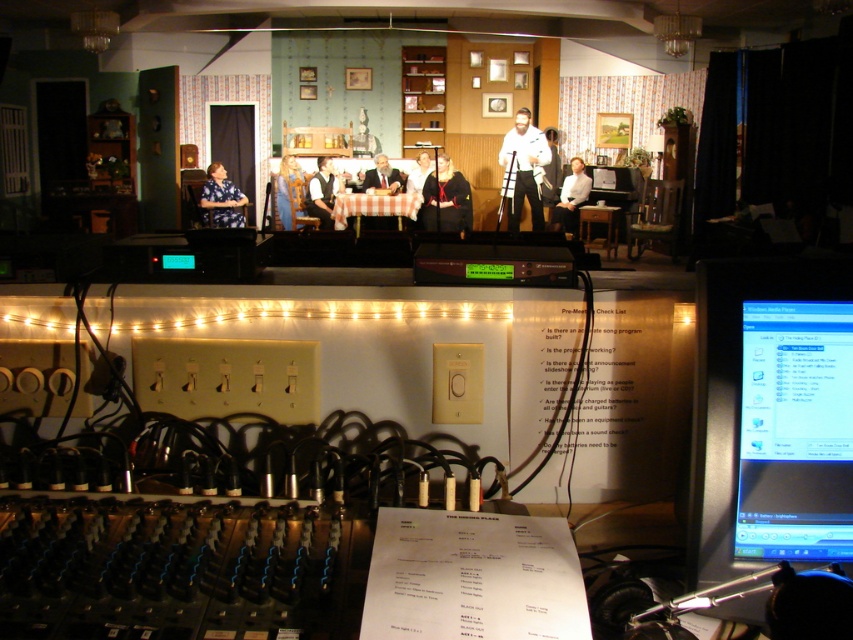
Does wooden table at center have a greater width compared to white shirt at center?

No.

Who is positioned more to the left, wooden table at center or white shirt at center?

white shirt at center

Between point (612, 250) and point (561, 228), which one is positioned in front?

Point (561, 228) is more forward.

I want to click on wooden table at center, so click(x=599, y=227).

Can you confirm if matte black monitor at lower right is wider than smooth white shirt at center?

In fact, matte black monitor at lower right might be narrower than smooth white shirt at center.

This screenshot has height=640, width=853. Identify the location of matte black monitor at lower right. (770, 416).

Is point (721, 358) in front of point (418, 189)?

Yes, point (721, 358) is closer to viewer.

This screenshot has width=853, height=640. What are the coordinates of `matte black monitor at lower right` in the screenshot? It's located at (770, 416).

How far apart are checkered fabric table at center and wooden table at center?

checkered fabric table at center is 7.03 feet away from wooden table at center.

How far apart are checkered fabric table at center and wooden table at center?

2.14 meters

Measure the distance between checkered fabric table at center and camera.

A distance of 8.47 meters exists between checkered fabric table at center and camera.

Locate an element on the screen. This screenshot has height=640, width=853. checkered fabric table at center is located at coordinates (374, 205).